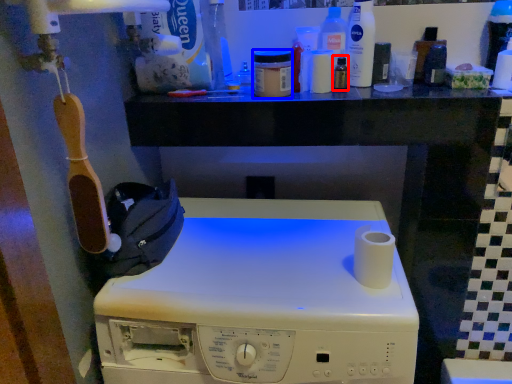
Question: Among these objects, which one is farthest to the camera, toiletry (highlighted by a red box) or toiletry (highlighted by a blue box)?

Choices:
 (A) toiletry
 (B) toiletry

Answer: (A)